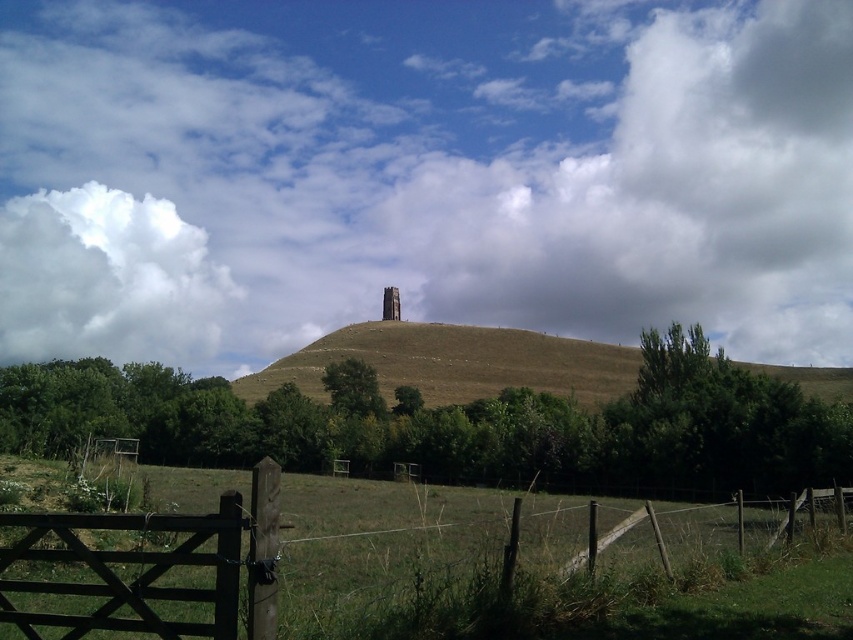
You are standing at the wooden gate with a chain lock in the rural landscape scene. You want to take a photo of the white fluffy cloud at upper center using a camera that has a maximum focus range of 200 meters. Will the camera be able to focus on the cloud?

The white fluffy cloud at upper center and the camera are 203.53 meters apart. Since the camera can only focus up to 200 meters, it cannot focus on the cloud.

Consider the image. You are standing at the wooden gate and want to reach the stone tower at center. The brown grassy hill at center is blocking your path. Can you go around it? Please explain your reasoning.

The brown grassy hill at center is 38.37 meters away from the stone tower at center. Since the hill is between you and the tower, you can go around it by moving either to the left or right side of the hill to reach the stone tower at center.

You are a photographer wanting to capture the stone tower at center without any obstructions. Given the current scene, would the white fluffy cloud at upper center block your view of the tower?

The stone tower at center is behind the white fluffy cloud at upper center, so the cloud would block your view of the tower.